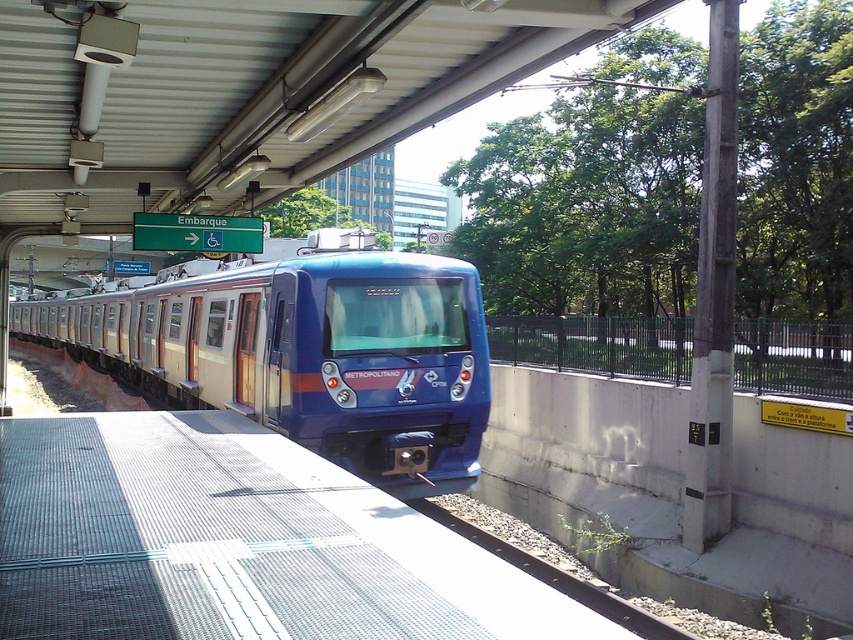
You are a passenger waiting at the train station platform. You see the blue metallic train at center and the rusty metal train track at lower center. Which object is closer to you as you stand on the platform?

The blue metallic train at center is closer to you because the rusty metal train track at lower center is behind it.

Where is the blue metallic train at center located in the image?

The blue metallic train at center is located at point (x=305, y=349) in the image.

In the scene shown: You are standing on the platform at the train station and want to move from the point closer to you to the point farther away. Which path should you take to go from the point at [105,336] to the point at [607,611]?

You should move from the point at [105,336] to the point at [607,611] by going away from the viewer since point [105,336] is closer to you and point [607,611] is farther away.